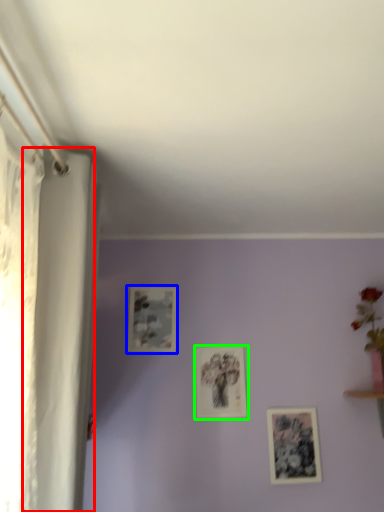
Question: Which object is positioned closest to curtain (highlighted by a red box)? Select from picture frame (highlighted by a blue box) and picture frame (highlighted by a green box).

Choices:
 (A) picture frame
 (B) picture frame

Answer: (A)